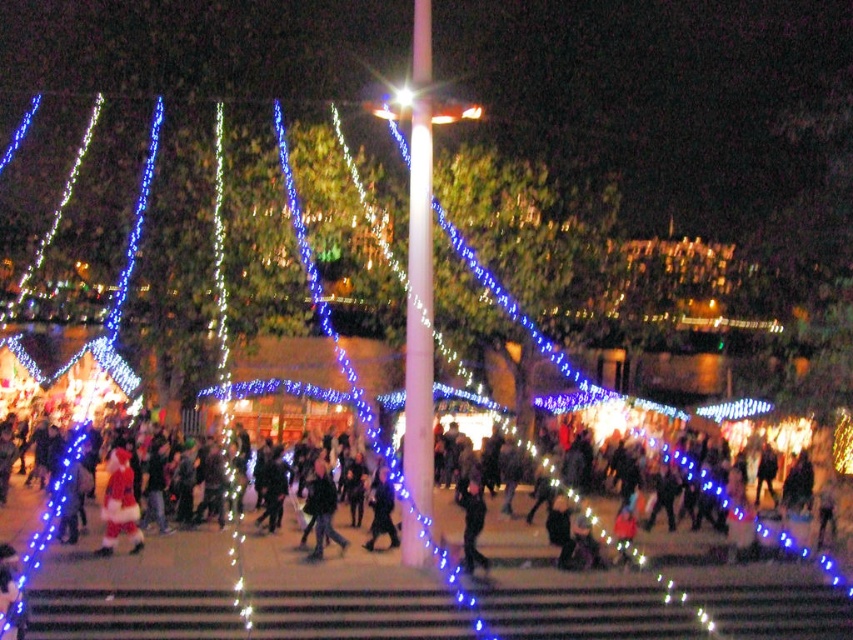
Is dark clothing crowd at center wider than dark gray jacket at center?

Yes.

Does point (300, 632) lie in front of point (315, 524)?

Yes, it is in front of point (315, 524).

Between point (440, 602) and point (340, 545), which one is positioned behind?

Point (340, 545)

Where is `dark clothing crowd at center`? The height and width of the screenshot is (640, 853). dark clothing crowd at center is located at coordinates (422, 592).

Is fuzzy red santa at center above dark gray jacket at center?

Yes.

Between fuzzy red santa at center and dark gray jacket at center, which one has less height?

dark gray jacket at center

From the picture: Who is more distant from viewer, (x=119, y=531) or (x=326, y=464)?

Point (x=326, y=464)

I want to click on fuzzy red santa at center, so click(119, 502).

Can you confirm if dark gray jacket at center is smaller than dark blue jeans at center?

No.

This screenshot has height=640, width=853. I want to click on dark gray jacket at center, so click(x=321, y=509).

The width and height of the screenshot is (853, 640). I want to click on dark gray jacket at center, so click(321, 509).